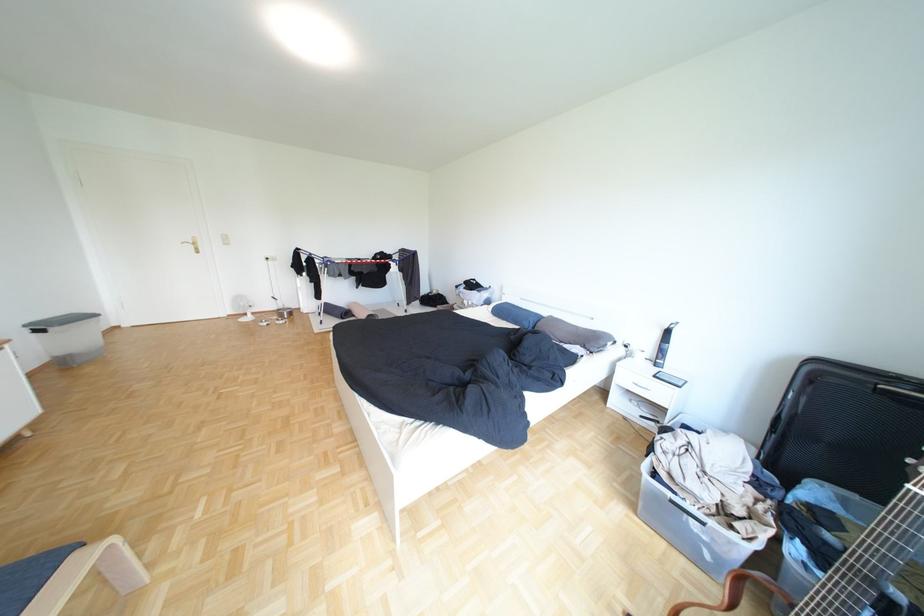
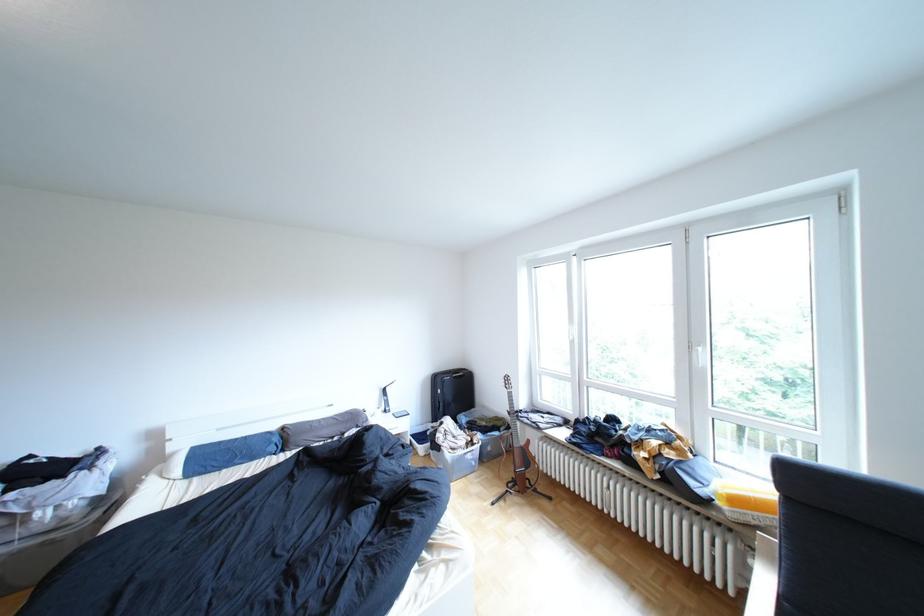
The point at [695,479] is marked in the first image. Where is the corresponding point in the second image?

(470, 446)